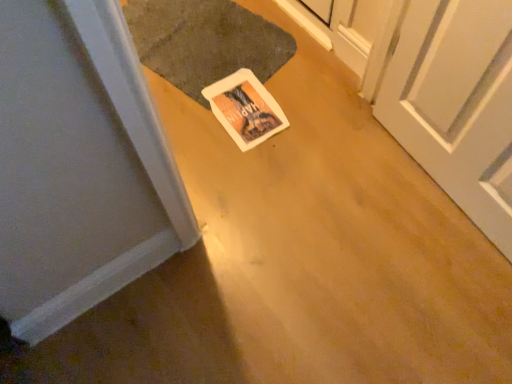
Question: Is point (229, 130) closer or farther from the camera than point (180, 74)?

Choices:
 (A) farther
 (B) closer

Answer: (B)

Question: Considering the positions of white paper postcard at center and dark gray textured mat at center in the image, is white paper postcard at center taller or shorter than dark gray textured mat at center?

Choices:
 (A) tall
 (B) short

Answer: (B)

Question: Visually, is white paper postcard at center positioned to the left or to the right of dark gray textured mat at center?

Choices:
 (A) right
 (B) left

Answer: (A)

Question: In terms of width, does dark gray textured mat at center look wider or thinner when compared to white paper postcard at center?

Choices:
 (A) wide
 (B) thin

Answer: (A)

Question: In terms of height, does dark gray textured mat at center look taller or shorter compared to white paper postcard at center?

Choices:
 (A) short
 (B) tall

Answer: (B)

Question: Considering the positions of point pos(165,49) and point pos(240,137), is point pos(165,49) closer or farther from the camera than point pos(240,137)?

Choices:
 (A) closer
 (B) farther

Answer: (B)

Question: Considering the positions of dark gray textured mat at center and white paper postcard at center in the image, is dark gray textured mat at center bigger or smaller than white paper postcard at center?

Choices:
 (A) small
 (B) big

Answer: (B)